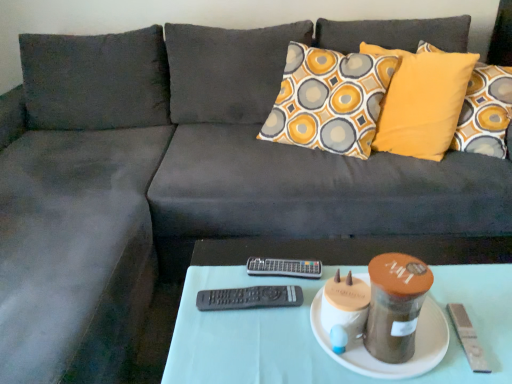
Where is `vacant area situated to the left side of black plastic remote at center, the 1th remote when ordered from front to back`? The height and width of the screenshot is (384, 512). vacant area situated to the left side of black plastic remote at center, the 1th remote when ordered from front to back is located at coordinates (196, 308).